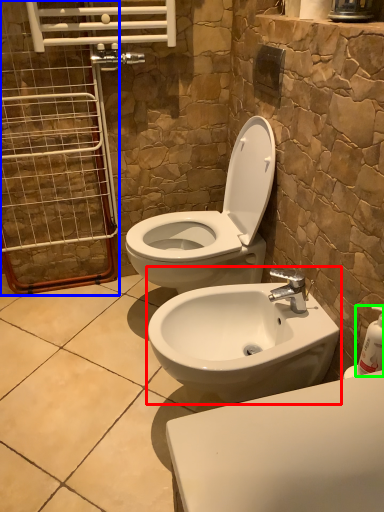
Question: Which object is the closest to the sink (highlighted by a red box)? Choose among these: screen door (highlighted by a blue box) or soap dispenser (highlighted by a green box).

Choices:
 (A) screen door
 (B) soap dispenser

Answer: (B)